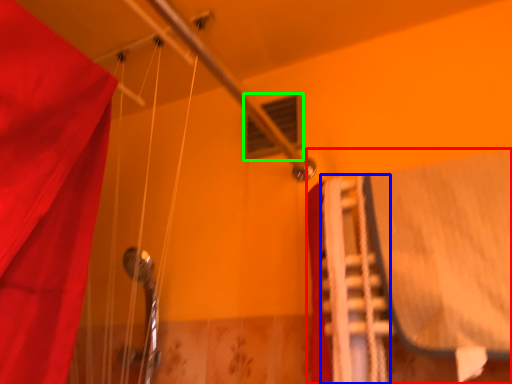
Question: Considering the real-world distances, which object is closest to bed (highlighted by a red box)? stair (highlighted by a blue box) or window (highlighted by a green box).

Choices:
 (A) stair
 (B) window

Answer: (A)